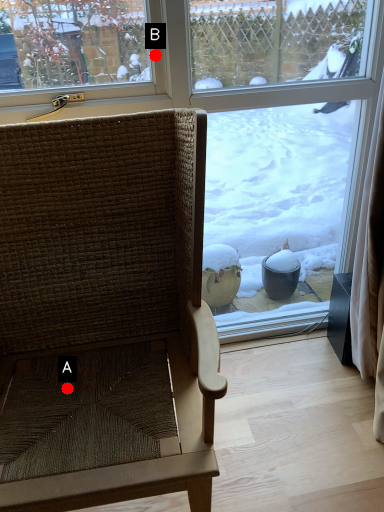
Question: Two points are circled on the image, labeled by A and B beside each circle. Which of the following is the farthest from the observer?

Choices:
 (A) A is further
 (B) B is further

Answer: (B)